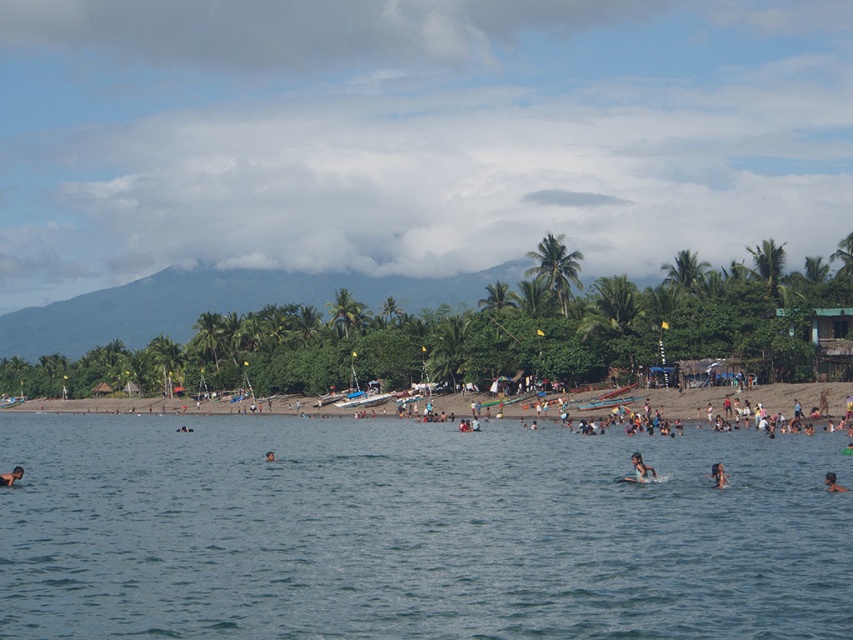
Who is lower down, dark brown skin at lower left or dark blue swimwear at center?

dark blue swimwear at center is below.

Does dark brown skin at lower left have a smaller size compared to dark blue swimwear at center?

No.

Who is more forward, (7,480) or (181,429)?

→ Point (7,480) is more forward.

Find the location of a particular element. This screenshot has height=640, width=853. dark brown skin at lower left is located at coordinates (10, 476).

Who is positioned more to the right, dark brown skin at lower left or smooth skin head at lower right?

smooth skin head at lower right is more to the right.

What do you see at coordinates (10, 476) in the screenshot? I see `dark brown skin at lower left` at bounding box center [10, 476].

Locate an element on the screen. The width and height of the screenshot is (853, 640). dark brown skin at lower left is located at coordinates [x=10, y=476].

Consider the image. Is dark brown skin at lower left closer to the viewer compared to brown hair at center?

Yes, it is in front of brown hair at center.

Between point (9, 484) and point (268, 458), which one is positioned behind?

Positioned behind is point (268, 458).

Where is `dark brown skin at lower left`? dark brown skin at lower left is located at coordinates (10, 476).